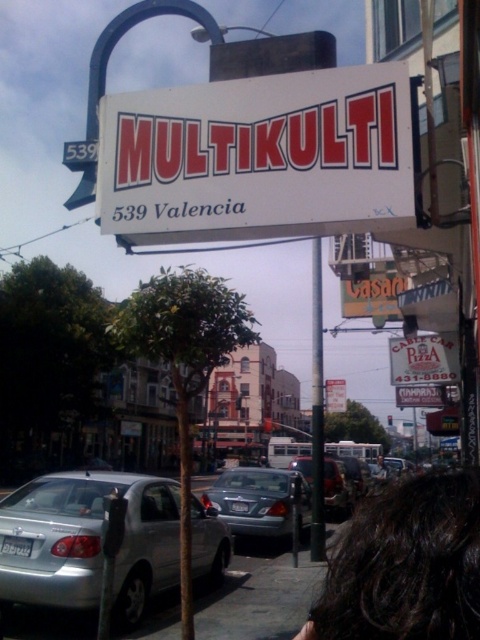
You are a delivery person trying to park your truck between the silver metallic car at lower left and the matte silver sedan at center. Can you estimate if there is enough space between them to fit your truck which is 2.5 meters wide?

The silver metallic car at lower left might be wider than matte silver sedan at center, so there might not be enough space between them to fit a truck that is 2.5 meters wide.

You are a delivery driver who needs to park your metallic silver sedan at center in a spot that requires precise positioning. What are the coordinates where you should place your vehicle?

The metallic silver sedan at center should be positioned at coordinates point (259, 500).

You are a photographer trying to capture a clear shot of the MULTIKULTI sign at 539 Valencia. You notice a person with dark hair at lower right and a matte silver sedan at center in your frame. Which object is narrower so you can position your camera to avoid blocking the sign?

The dark hair at lower right is narrower than the matte silver sedan at center, so positioning the camera to avoid the dark hair at lower right would leave more space for the sign.